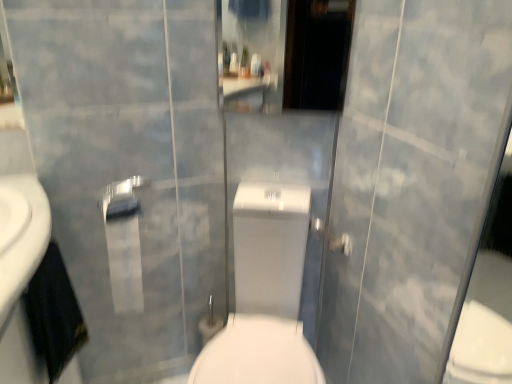
You are a GUI agent. You are given a task and a screenshot of the screen. Output one action in this format:
    pyautogui.click(x=<x>, y=<y>)
    Task: Click on the silver metallic towel bar at upper center
    This screenshot has height=384, width=512.
    Given the screenshot: What is the action you would take?
    point(121,198)

This screenshot has width=512, height=384. What do you see at coordinates (264, 293) in the screenshot?
I see `white glossy toilet at center` at bounding box center [264, 293].

The image size is (512, 384). I want to click on silver metallic towel bar at upper center, so click(121, 198).

Locate an element on the screen. towel bar located above the matte silver shower at center (from the image's perspective) is located at coordinates (121, 198).

Is silver metallic towel bar at upper center not within matte silver shower at center?

Yes, silver metallic towel bar at upper center is located beyond the bounds of matte silver shower at center.

From the image's perspective, is silver metallic towel bar at upper center located above matte silver shower at center?

Yes.

Is silver metallic towel bar at upper center placed right next to matte silver shower at center?

No, silver metallic towel bar at upper center is not touching matte silver shower at center.

Is white glossy toilet at center not near silver metallic towel bar at upper center?

No, white glossy toilet at center is not far from silver metallic towel bar at upper center.

Is white glossy toilet at center oriented away from silver metallic towel bar at upper center?

white glossy toilet at center is not turned away from silver metallic towel bar at upper center.

Can you confirm if white glossy toilet at center is shorter than silver metallic towel bar at upper center?

In fact, white glossy toilet at center may be taller than silver metallic towel bar at upper center.

Can you confirm if matte silver shower at center is bigger than silver metallic towel bar at upper center?

No, matte silver shower at center is not bigger than silver metallic towel bar at upper center.

Where is `towel bar above the matte silver shower at center (from a real-world perspective)`? towel bar above the matte silver shower at center (from a real-world perspective) is located at coordinates (121, 198).

Visually, is matte silver shower at center positioned to the left or to the right of silver metallic towel bar at upper center?

Clearly, matte silver shower at center is on the right of silver metallic towel bar at upper center in the image.

In the scene shown: Does matte silver shower at center appear on the right side of white glossy toilet at center?

Correct, you'll find matte silver shower at center to the right of white glossy toilet at center.

From a real-world perspective, does matte silver shower at center stand above white glossy toilet at center?

Yes, from a real-world perspective, matte silver shower at center is on top of white glossy toilet at center.

Is white glossy toilet at center at the back of matte silver shower at center?

Correct, matte silver shower at center is looking away from white glossy toilet at center.

Consider the image. Is matte silver shower at center beside white glossy toilet at center?

No, matte silver shower at center is not with white glossy toilet at center.

How many degrees apart are the facing directions of white glossy toilet at center and matte silver shower at center?

The angle between the facing direction of white glossy toilet at center and the facing direction of matte silver shower at center is 63.8 degrees.

Where is `sit lying below the matte silver shower at center (from the image's perspective)`? This screenshot has width=512, height=384. sit lying below the matte silver shower at center (from the image's perspective) is located at coordinates (264, 293).

Is white glossy toilet at center turned away from matte silver shower at center?

white glossy toilet at center is not turned away from matte silver shower at center.

In terms of width, does white glossy toilet at center look wider or thinner when compared to matte silver shower at center?

In the image, white glossy toilet at center appears to be wider than matte silver shower at center.

Can you confirm if silver metallic towel bar at upper center is bigger than white glossy toilet at center?

Actually, silver metallic towel bar at upper center might be smaller than white glossy toilet at center.

Is the position of silver metallic towel bar at upper center less distant than that of white glossy toilet at center?

No, silver metallic towel bar at upper center is behind white glossy toilet at center.

Looking at this image, can you tell me how much silver metallic towel bar at upper center and white glossy toilet at center differ in facing direction?

The facing directions of silver metallic towel bar at upper center and white glossy toilet at center are 25.6 degrees apart.

Find the location of a particular element. towel bar lying above the matte silver shower at center (from the image's perspective) is located at coordinates (121, 198).

This screenshot has width=512, height=384. I want to click on sit in front of the silver metallic towel bar at upper center, so click(264, 293).

Looking at the image, which one is located further to white glossy toilet at center, silver metallic towel bar at upper center or matte silver shower at center?

silver metallic towel bar at upper center is further to white glossy toilet at center.

When comparing their distances from silver metallic towel bar at upper center, does matte silver shower at center or white glossy toilet at center seem further?

matte silver shower at center is further to silver metallic towel bar at upper center.

Based on their spatial positions, is matte silver shower at center or silver metallic towel bar at upper center closer to white glossy toilet at center?

The object closer to white glossy toilet at center is matte silver shower at center.

Considering their positions, is silver metallic towel bar at upper center positioned closer to matte silver shower at center than white glossy toilet at center?

The object closer to matte silver shower at center is white glossy toilet at center.

Based on their spatial positions, is white glossy toilet at center or silver metallic towel bar at upper center closer to matte silver shower at center?

Based on the image, white glossy toilet at center appears to be nearer to matte silver shower at center.

From the image, which object appears to be nearer to silver metallic towel bar at upper center, white glossy toilet at center or matte silver shower at center?

Based on the image, white glossy toilet at center appears to be nearer to silver metallic towel bar at upper center.

Locate an element on the screen. sit between silver metallic towel bar at upper center and matte silver shower at center is located at coordinates (264, 293).